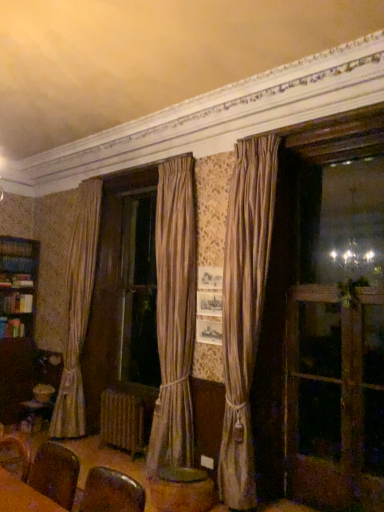
Question: Is brown leather armchair at lower left positioned beyond the bounds of white textured radiator at lower center?

Choices:
 (A) yes
 (B) no

Answer: (A)

Question: From a real-world perspective, is brown leather armchair at lower left located higher than white textured radiator at lower center?

Choices:
 (A) no
 (B) yes

Answer: (B)

Question: Can you confirm if brown leather armchair at lower left is shorter than white textured radiator at lower center?

Choices:
 (A) yes
 (B) no

Answer: (A)

Question: Is brown leather armchair at lower left taller than white textured radiator at lower center?

Choices:
 (A) yes
 (B) no

Answer: (B)

Question: Is brown leather armchair at lower left positioned with its back to white textured radiator at lower center?

Choices:
 (A) yes
 (B) no

Answer: (B)

Question: Can you see brown leather armchair at lower left touching white textured radiator at lower center?

Choices:
 (A) yes
 (B) no

Answer: (B)

Question: Is wooden round table at center positioned far away from silky beige curtain at center?

Choices:
 (A) no
 (B) yes

Answer: (A)

Question: Is wooden round table at center outside silky beige curtain at center?

Choices:
 (A) no
 (B) yes

Answer: (B)

Question: Is silky beige curtain at center inside wooden round table at center?

Choices:
 (A) yes
 (B) no

Answer: (B)

Question: Considering the relative sizes of wooden round table at center and silky beige curtain at center in the image provided, is wooden round table at center wider than silky beige curtain at center?

Choices:
 (A) yes
 (B) no

Answer: (A)

Question: From the image's perspective, is wooden round table at center above silky beige curtain at center?

Choices:
 (A) no
 (B) yes

Answer: (A)

Question: Can you confirm if wooden round table at center is thinner than silky beige curtain at center?

Choices:
 (A) no
 (B) yes

Answer: (A)

Question: Is wooden screen door at right at the back of wooden round table at center?

Choices:
 (A) no
 (B) yes

Answer: (A)